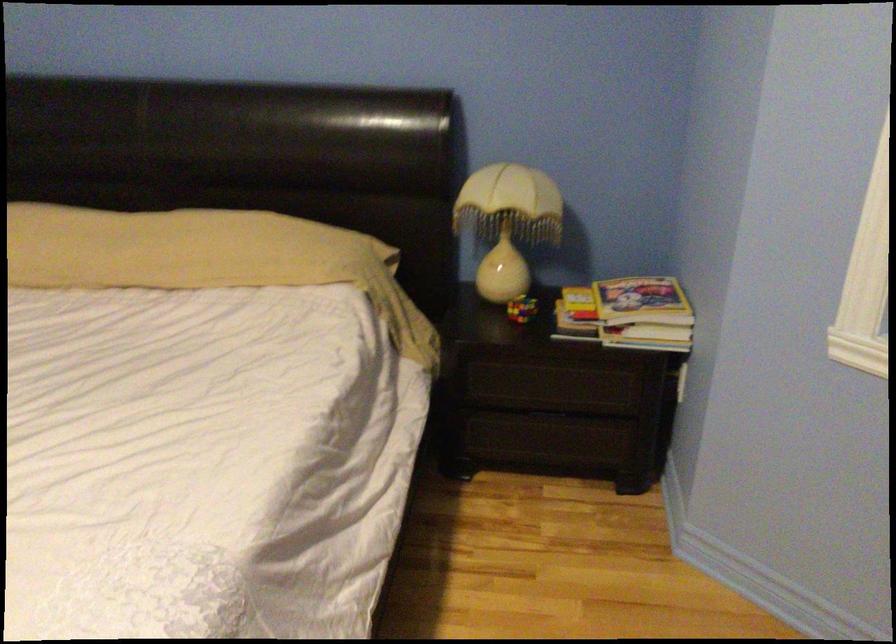
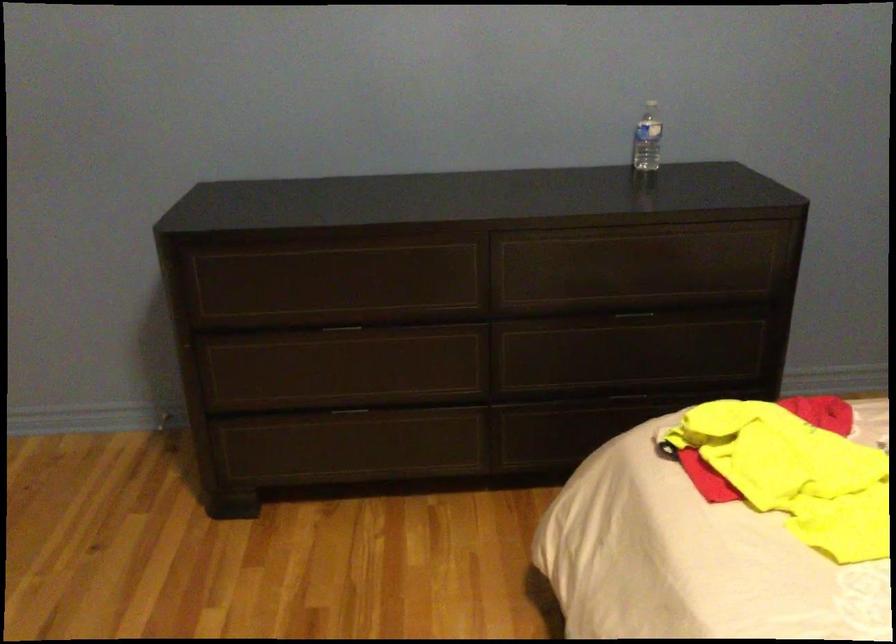
Based on the continuous images, in which direction is the camera rotating?

The camera rotated toward left-down.